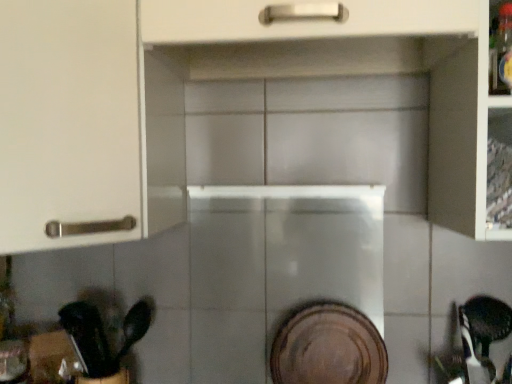
Question: Can you confirm if brown matte platter at center is positioned to the right of black plastic spoon at lower left?

Choices:
 (A) no
 (B) yes

Answer: (B)

Question: Considering the relative sizes of brown matte platter at center and black plastic spoon at lower left in the image provided, is brown matte platter at center thinner than black plastic spoon at lower left?

Choices:
 (A) yes
 (B) no

Answer: (A)

Question: Could black plastic spoon at lower left be considered to be inside brown matte platter at center?

Choices:
 (A) no
 (B) yes

Answer: (A)

Question: Is brown matte platter at center shorter than black plastic spoon at lower left?

Choices:
 (A) no
 (B) yes

Answer: (A)

Question: Is brown matte platter at center smaller than black plastic spoon at lower left?

Choices:
 (A) yes
 (B) no

Answer: (A)

Question: Choose the correct answer: Is brown matte platter at center inside black plastic spoon at lower left or outside it?

Choices:
 (A) outside
 (B) inside

Answer: (A)

Question: Considering the positions of point (287, 337) and point (87, 316), is point (287, 337) closer or farther from the camera than point (87, 316)?

Choices:
 (A) farther
 (B) closer

Answer: (B)

Question: Looking at the image, does brown matte platter at center seem bigger or smaller compared to black plastic spoon at lower left?

Choices:
 (A) big
 (B) small

Answer: (B)

Question: From the image's perspective, is brown matte platter at center located above or below black plastic spoon at lower left?

Choices:
 (A) below
 (B) above

Answer: (A)

Question: From a real-world perspective, is black plastic spoon at lower left above or below brown matte platter at center?

Choices:
 (A) below
 (B) above

Answer: (B)

Question: Is black plastic spoon at lower left spatially inside brown matte platter at center, or outside of it?

Choices:
 (A) inside
 (B) outside

Answer: (B)

Question: In the image, is black plastic spoon at lower left positioned in front of or behind brown matte platter at center?

Choices:
 (A) front
 (B) behind

Answer: (A)

Question: Looking at the image, does black plastic spoon at lower left seem bigger or smaller compared to brown matte platter at center?

Choices:
 (A) small
 (B) big

Answer: (B)

Question: Relative to brown matte platter at center, is white matte cabinet at upper left in front or behind?

Choices:
 (A) front
 (B) behind

Answer: (A)

Question: From the image's perspective, is white matte cabinet at upper left positioned above or below brown matte platter at center?

Choices:
 (A) above
 (B) below

Answer: (A)